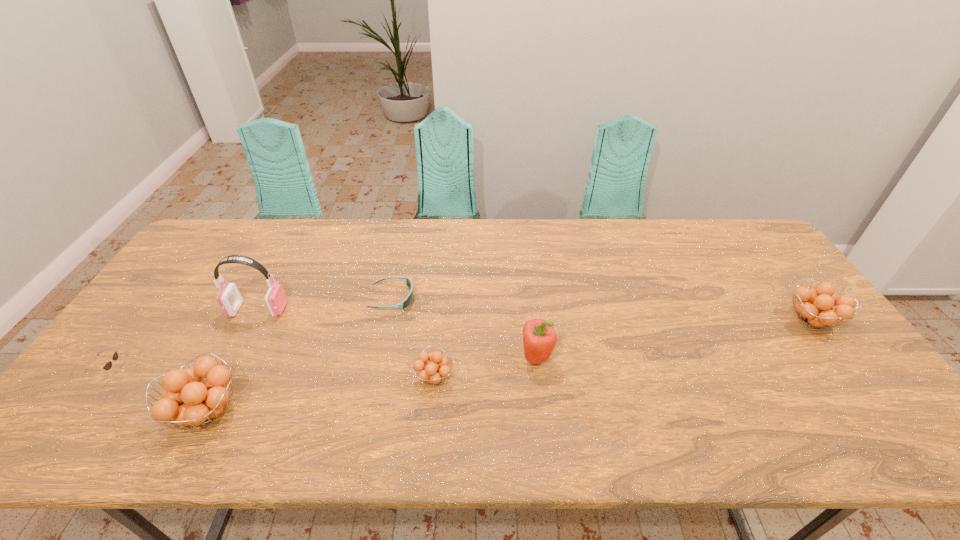
You are a GUI agent. You are given a task and a screenshot of the screen. Output one action in this format:
    pyautogui.click(x=<x>, y=<y>)
    Task: Click on the leftmost orange fruit
    
    Given the screenshot: What is the action you would take?
    pos(204,402)

Find the location of a particular element. The height and width of the screenshot is (540, 960). the second orange fruit from right to left is located at coordinates (438, 369).

In order to click on the third shortest object in this screenshot , I will do `click(438, 369)`.

Locate an element on the screen. The image size is (960, 540). the rightmost orange fruit is located at coordinates (815, 307).

Identify the location of the fourth shortest object. (815, 307).

Image resolution: width=960 pixels, height=540 pixels. Identify the location of the farther sunglasses. (409, 284).

The width and height of the screenshot is (960, 540). In order to click on the fourth object from left to right in this screenshot , I will do `click(409, 284)`.

Image resolution: width=960 pixels, height=540 pixels. I want to click on the second object from right to left, so [x=539, y=337].

What are the coordinates of `the nearer sunglasses` in the screenshot? It's located at (108, 365).

The width and height of the screenshot is (960, 540). I want to click on the left sunglasses, so click(x=108, y=365).